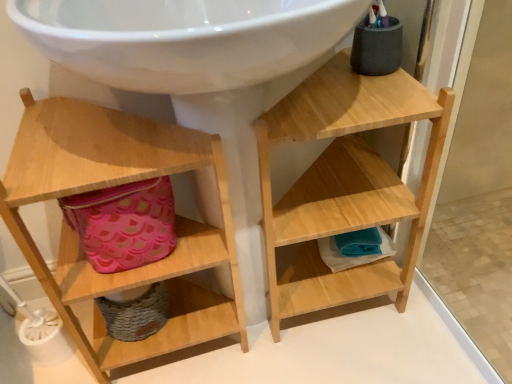
At what (x,y) coordinates should I click in order to perform the action: click on pink fabric basket at lower left. Please return your answer as a coordinate pair (x, y). Image resolution: width=512 pixels, height=384 pixels. Looking at the image, I should click on (124, 224).

Considering the positions of objects natural wood shelf at upper right, the 1th shelf when ordered from right to left, and pink fabric basket at lower left in the image provided, who is more to the left, natural wood shelf at upper right, the 1th shelf when ordered from right to left, or pink fabric basket at lower left?

From the viewer's perspective, pink fabric basket at lower left appears more on the left side.

Are natural wood shelf at upper right, the 2th shelf from the left, and pink fabric basket at lower left making contact?

natural wood shelf at upper right, the 2th shelf from the left, and pink fabric basket at lower left are not in contact.

Is point (288, 137) behind point (86, 214)?

That is False.

Considering the relative sizes of natural wood shelf at upper right, the 1th shelf when ordered from right to left, and pink fabric basket at lower left in the image provided, is natural wood shelf at upper right, the 1th shelf when ordered from right to left, taller than pink fabric basket at lower left?

Yes, natural wood shelf at upper right, the 1th shelf when ordered from right to left, is taller than pink fabric basket at lower left.

Who is smaller, natural wood shelf at upper right, the 1th shelf when ordered from right to left, or wooden shelf at left, which is counted as the 2th shelf, starting from the right?

Smaller between the two is natural wood shelf at upper right, the 1th shelf when ordered from right to left.

Is natural wood shelf at upper right, the 1th shelf when ordered from right to left, to the right of wooden shelf at left, the first shelf from the left, from the viewer's perspective?

Correct, you'll find natural wood shelf at upper right, the 1th shelf when ordered from right to left, to the right of wooden shelf at left, the first shelf from the left.

In terms of height, does natural wood shelf at upper right, the 2th shelf from the left, look taller or shorter compared to wooden shelf at left, which is counted as the 2th shelf, starting from the right?

In the image, natural wood shelf at upper right, the 2th shelf from the left, appears to be shorter than wooden shelf at left, which is counted as the 2th shelf, starting from the right.

In terms of width, does wooden shelf at left, the first shelf from the left, look wider or thinner when compared to pink fabric basket at lower left?

wooden shelf at left, the first shelf from the left, is wider than pink fabric basket at lower left.

Could you tell me if wooden shelf at left, which is counted as the 2th shelf, starting from the right, is facing pink fabric basket at lower left?

Yes, wooden shelf at left, which is counted as the 2th shelf, starting from the right, is facing pink fabric basket at lower left.

How distant is wooden shelf at left, the first shelf from the left, from pink fabric basket at lower left?

wooden shelf at left, the first shelf from the left, and pink fabric basket at lower left are 4.08 inches apart.

Which of these two, wooden shelf at left, the first shelf from the left, or pink fabric basket at lower left, stands shorter?

pink fabric basket at lower left is shorter.

From a real-world perspective, between pink fabric basket at lower left and natural wood shelf at upper right, the 1th shelf when ordered from right to left, who is vertically higher?

pink fabric basket at lower left, from a real-world perspective.

Can you confirm if pink fabric basket at lower left is smaller than natural wood shelf at upper right, the 2th shelf from the left?

Yes, pink fabric basket at lower left is smaller than natural wood shelf at upper right, the 2th shelf from the left.

Considering the positions of objects pink fabric basket at lower left and natural wood shelf at upper right, the 1th shelf when ordered from right to left, in the image provided, who is more to the left, pink fabric basket at lower left or natural wood shelf at upper right, the 1th shelf when ordered from right to left,?

Positioned to the left is pink fabric basket at lower left.

Considering the positions of points (156, 184) and (239, 292), is point (156, 184) closer to camera compared to point (239, 292)?

Yes, point (156, 184) is in front of point (239, 292).

Would you say pink fabric basket at lower left is outside wooden shelf at left, which is counted as the 2th shelf, starting from the right?

No, pink fabric basket at lower left is not outside of wooden shelf at left, which is counted as the 2th shelf, starting from the right.

Is pink fabric basket at lower left taller than wooden shelf at left, which is counted as the 2th shelf, starting from the right?

Incorrect, the height of pink fabric basket at lower left is not larger of that of wooden shelf at left, which is counted as the 2th shelf, starting from the right.

From the image's perspective, between pink fabric basket at lower left and wooden shelf at left, which is counted as the 2th shelf, starting from the right, which one is located above?

pink fabric basket at lower left appears higher in the image.

Is natural wood shelf at upper right, the 1th shelf when ordered from right to left, surrounded by wooden shelf at left, the first shelf from the left?

No, natural wood shelf at upper right, the 1th shelf when ordered from right to left, is not inside wooden shelf at left, the first shelf from the left.

Is wooden shelf at left, which is counted as the 2th shelf, starting from the right, far from natural wood shelf at upper right, the 2th shelf from the left?

No, wooden shelf at left, which is counted as the 2th shelf, starting from the right, is in close proximity to natural wood shelf at upper right, the 2th shelf from the left.

In terms of height, does wooden shelf at left, the first shelf from the left, look taller or shorter compared to natural wood shelf at upper right, the 1th shelf when ordered from right to left?

wooden shelf at left, the first shelf from the left, is taller than natural wood shelf at upper right, the 1th shelf when ordered from right to left.

Is wooden shelf at left, which is counted as the 2th shelf, starting from the right, looking in the opposite direction of natural wood shelf at upper right, the 2th shelf from the left?

No, natural wood shelf at upper right, the 2th shelf from the left, is not at the back of wooden shelf at left, which is counted as the 2th shelf, starting from the right.

There is a natural wood shelf at upper right, the 1th shelf when ordered from right to left. Where is `basket above it (from a real-world perspective)`? basket above it (from a real-world perspective) is located at coordinates (124, 224).

At what (x,y) coordinates should I click in order to perform the action: click on shelf below the natural wood shelf at upper right, the 1th shelf when ordered from right to left (from the image's perspective). Please return your answer as a coordinate pair (x, y). Image resolution: width=512 pixels, height=384 pixels. Looking at the image, I should click on (115, 185).

Estimate the real-world distances between objects in this image. Which object is further from pink fabric basket at lower left, natural wood shelf at upper right, the 2th shelf from the left, or wooden shelf at left, the first shelf from the left?

Based on the image, natural wood shelf at upper right, the 2th shelf from the left, appears to be further to pink fabric basket at lower left.

Considering their positions, is wooden shelf at left, which is counted as the 2th shelf, starting from the right, positioned further to pink fabric basket at lower left than natural wood shelf at upper right, the 2th shelf from the left?

natural wood shelf at upper right, the 2th shelf from the left.

Estimate the real-world distances between objects in this image. Which object is closer to wooden shelf at left, which is counted as the 2th shelf, starting from the right, natural wood shelf at upper right, the 2th shelf from the left, or pink fabric basket at lower left?

pink fabric basket at lower left.

Considering their positions, is pink fabric basket at lower left positioned closer to wooden shelf at left, the first shelf from the left, than natural wood shelf at upper right, the 1th shelf when ordered from right to left?

Among the two, pink fabric basket at lower left is located nearer to wooden shelf at left, the first shelf from the left.

Based on their spatial positions, is pink fabric basket at lower left or wooden shelf at left, the first shelf from the left, closer to natural wood shelf at upper right, the 1th shelf when ordered from right to left?

wooden shelf at left, the first shelf from the left.

From the image, which object appears to be farther from natural wood shelf at upper right, the 2th shelf from the left, wooden shelf at left, which is counted as the 2th shelf, starting from the right, or pink fabric basket at lower left?

pink fabric basket at lower left is further to natural wood shelf at upper right, the 2th shelf from the left.

Where is `shelf between pink fabric basket at lower left and natural wood shelf at upper right, the 1th shelf when ordered from right to left`? shelf between pink fabric basket at lower left and natural wood shelf at upper right, the 1th shelf when ordered from right to left is located at coordinates (115, 185).